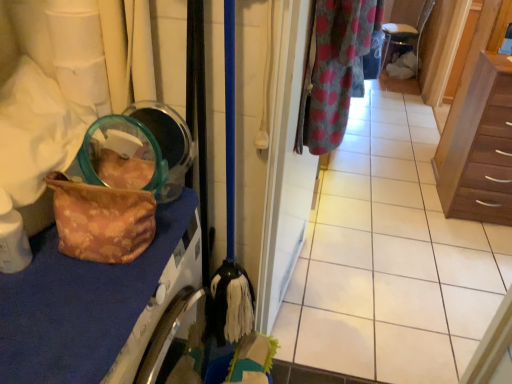
Locate an element on the screen. This screenshot has height=384, width=512. brown wood chest of drawers at right is located at coordinates (479, 146).

In order to face brown wood chest of drawers at right, should I rotate leftwards or rightwards?

A 30.706 degree turn to the right will do.

What do you see at coordinates (285, 165) in the screenshot? I see `polka dot fabric door at center` at bounding box center [285, 165].

The width and height of the screenshot is (512, 384). Find the location of `floral fabric bag at left`. floral fabric bag at left is located at coordinates (57, 327).

At what (x,y) coordinates should I click in order to perform the action: click on brown wood chest of drawers at right. Please return your answer as a coordinate pair (x, y). This screenshot has width=512, height=384. Looking at the image, I should click on (479, 146).

From a real-world perspective, does brown wood chest of drawers at right stand above floral fabric bag at left?

No.

From the image's perspective, relative to floral fabric bag at left, is brown wood chest of drawers at right above or below?

Based on their image positions, brown wood chest of drawers at right is located above floral fabric bag at left.

In the image, is brown wood chest of drawers at right positioned in front of or behind floral fabric bag at left?

In the image, brown wood chest of drawers at right appears behind floral fabric bag at left.

Between brown wood chest of drawers at right and floral fabric bag at left, which one has larger size?

With larger size is brown wood chest of drawers at right.

Considering the positions of objects floral fabric bag at left and brown wood chest of drawers at right in the image provided, who is behind, floral fabric bag at left or brown wood chest of drawers at right?

Positioned behind is brown wood chest of drawers at right.

Is floral fabric bag at left not inside brown wood chest of drawers at right?

Indeed, floral fabric bag at left is completely outside brown wood chest of drawers at right.

Considering the relative sizes of floral fabric bag at left and brown wood chest of drawers at right in the image provided, is floral fabric bag at left thinner than brown wood chest of drawers at right?

Indeed, floral fabric bag at left has a lesser width compared to brown wood chest of drawers at right.

Who is smaller, floral fabric bag at left or brown wood chest of drawers at right?

floral fabric bag at left is smaller.

Is point (331, 118) positioned before point (278, 227)?

That is True.

Is polka dot fabric door at center at the back of gray polka dot fabric at upper right?

Yes, gray polka dot fabric at upper right's orientation is away from polka dot fabric door at center.

Is gray polka dot fabric at upper right surrounding polka dot fabric door at center?

No, polka dot fabric door at center is located outside of gray polka dot fabric at upper right.

From a real-world perspective, who is located higher, gray polka dot fabric at upper right or polka dot fabric door at center?

In real-world perspective, gray polka dot fabric at upper right is above.

Considering the positions of objects polka dot fabric door at center and floral fabric bag at left in the image provided, who is behind, polka dot fabric door at center or floral fabric bag at left?

polka dot fabric door at center is further from the camera.

Is polka dot fabric door at center oriented away from floral fabric bag at left?

No, polka dot fabric door at center's orientation is not away from floral fabric bag at left.

Is polka dot fabric door at center taller or shorter than floral fabric bag at left?

In the image, polka dot fabric door at center appears to be taller than floral fabric bag at left.

Consider the image. From the image's perspective, does polka dot fabric door at center appear lower than floral fabric bag at left?

Actually, polka dot fabric door at center appears above floral fabric bag at left in the image.

Considering the sizes of floral fabric bag at left and gray polka dot fabric at upper right in the image, is floral fabric bag at left bigger or smaller than gray polka dot fabric at upper right?

Considering their sizes, floral fabric bag at left takes up less space than gray polka dot fabric at upper right.

From the image's perspective, is floral fabric bag at left above gray polka dot fabric at upper right?

Incorrect, from the image's perspective, floral fabric bag at left is lower than gray polka dot fabric at upper right.

What's the angular difference between floral fabric bag at left and gray polka dot fabric at upper right's facing directions?

The angular difference between floral fabric bag at left and gray polka dot fabric at upper right is 3.64 degrees.

Which of these two, floral fabric bag at left or gray polka dot fabric at upper right, stands taller?

With more height is gray polka dot fabric at upper right.

Does brown wood chest of drawers at right have a smaller size compared to gray polka dot fabric at upper right?

Actually, brown wood chest of drawers at right might be larger than gray polka dot fabric at upper right.

Between brown wood chest of drawers at right and gray polka dot fabric at upper right, which one has larger width?

brown wood chest of drawers at right.

Considering the positions of point (460, 135) and point (315, 92), is point (460, 135) closer or farther from the camera than point (315, 92)?

Point (460, 135).

Is polka dot fabric door at center closer to camera compared to brown wood chest of drawers at right?

Yes, the depth of polka dot fabric door at center is less than that of brown wood chest of drawers at right.

Is polka dot fabric door at center to the right of brown wood chest of drawers at right from the viewer's perspective?

No, polka dot fabric door at center is not to the right of brown wood chest of drawers at right.

Is polka dot fabric door at center thinner than brown wood chest of drawers at right?

Yes.

This screenshot has width=512, height=384. Find the location of `chest of drawers on the right of the floral fabric bag at left`. chest of drawers on the right of the floral fabric bag at left is located at coordinates pos(479,146).

Where is `chest of drawers below the floral fabric bag at left (from a real-world perspective)`? chest of drawers below the floral fabric bag at left (from a real-world perspective) is located at coordinates (479, 146).

From the image, which object appears to be nearer to polka dot fabric door at center, floral fabric bag at left or gray polka dot fabric at upper right?

Among the two, gray polka dot fabric at upper right is located nearer to polka dot fabric door at center.

Based on their spatial positions, is gray polka dot fabric at upper right or floral fabric bag at left further from brown wood chest of drawers at right?

floral fabric bag at left lies further to brown wood chest of drawers at right than the other object.

Looking at the image, which one is located further to floral fabric bag at left, gray polka dot fabric at upper right or brown wood chest of drawers at right?

The object further to floral fabric bag at left is brown wood chest of drawers at right.

Looking at the image, which one is located closer to floral fabric bag at left, polka dot fabric door at center or gray polka dot fabric at upper right?

Among the two, polka dot fabric door at center is located nearer to floral fabric bag at left.

When comparing their distances from floral fabric bag at left, does gray polka dot fabric at upper right or polka dot fabric door at center seem further?

gray polka dot fabric at upper right lies further to floral fabric bag at left than the other object.

Estimate the real-world distances between objects in this image. Which object is closer to polka dot fabric door at center, brown wood chest of drawers at right or gray polka dot fabric at upper right?

gray polka dot fabric at upper right.

From the picture: When comparing their distances from brown wood chest of drawers at right, does floral fabric bag at left or polka dot fabric door at center seem closer?

polka dot fabric door at center lies closer to brown wood chest of drawers at right than the other object.

Estimate the real-world distances between objects in this image. Which object is further from gray polka dot fabric at upper right, brown wood chest of drawers at right or polka dot fabric door at center?

brown wood chest of drawers at right is further to gray polka dot fabric at upper right.

Locate an element on the screen. Image resolution: width=512 pixels, height=384 pixels. door between floral fabric bag at left and gray polka dot fabric at upper right in the horizontal direction is located at coordinates (285, 165).

The height and width of the screenshot is (384, 512). Find the location of `clothing between polka dot fabric door at center and brown wood chest of drawers at right in the horizontal direction`. clothing between polka dot fabric door at center and brown wood chest of drawers at right in the horizontal direction is located at coordinates (334, 70).

What are the coordinates of `clothing located between floral fabric bag at left and brown wood chest of drawers at right in the left-right direction` in the screenshot? It's located at (334, 70).

Where is `door between floral fabric bag at left and brown wood chest of drawers at right in the horizontal direction`? This screenshot has width=512, height=384. door between floral fabric bag at left and brown wood chest of drawers at right in the horizontal direction is located at coordinates (285, 165).